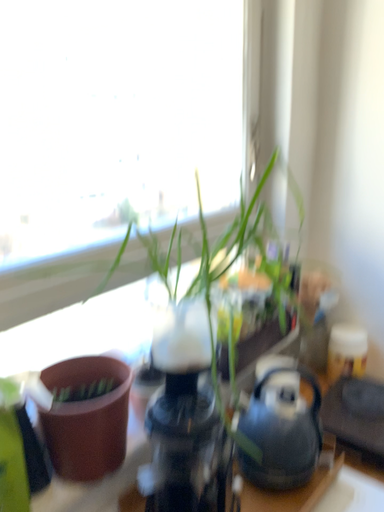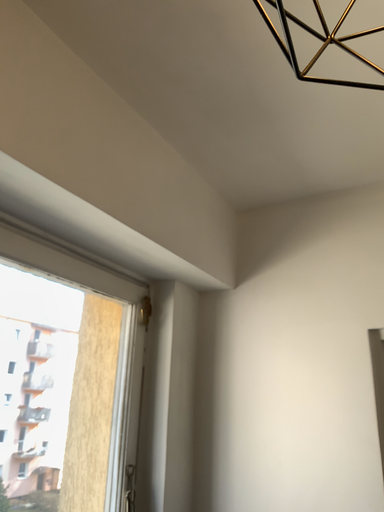
Question: Which way did the camera rotate in the video?

Choices:
 (A) rotated left
 (B) rotated right

Answer: (B)